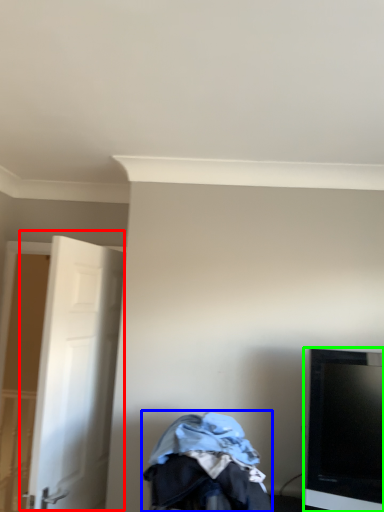
Question: Which object is the farthest from door (highlighted by a red box)? Choose among these: baby carriage (highlighted by a blue box) or television (highlighted by a green box).

Choices:
 (A) baby carriage
 (B) television

Answer: (B)